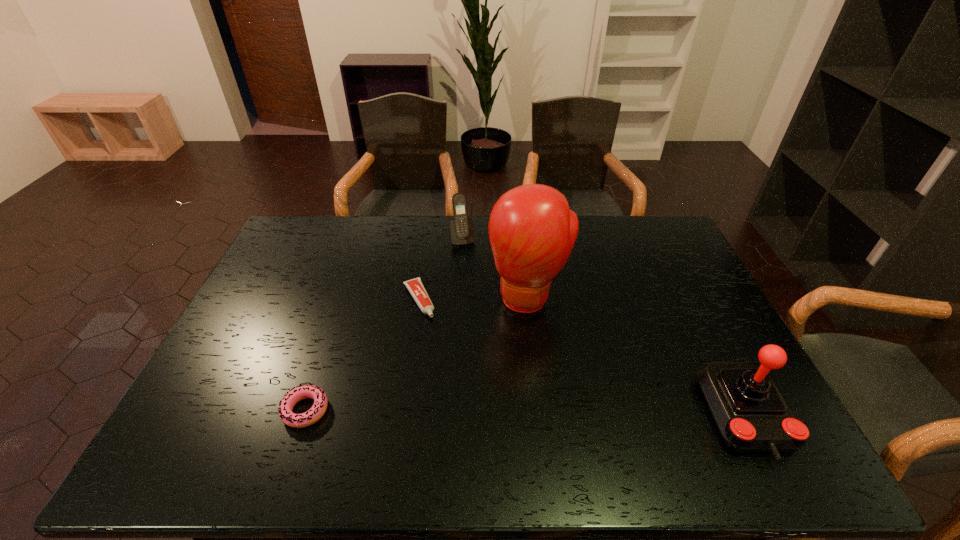
Identify which object is the second closest to the third object from left to right. Please provide its 2D coordinates. Your answer should be formatted as a tuple, i.e. [(x, y)], where the tuple contains the x and y coordinates of a point satisfying the conditions above.

[(415, 286)]

This screenshot has width=960, height=540. Identify the location of the second closest object to the boxing glove. (462, 231).

Locate an element on the screen. The width and height of the screenshot is (960, 540). vacant region that satisfies the following two spatial constraints: 1. on the back side of the fourth object from right to left; 2. on the left side of the doughnut is located at coordinates (343, 300).

This screenshot has width=960, height=540. I want to click on vacant space that satisfies the following two spatial constraints: 1. on the back side of the leftmost object; 2. on the right side of the third object from right to left, so click(364, 238).